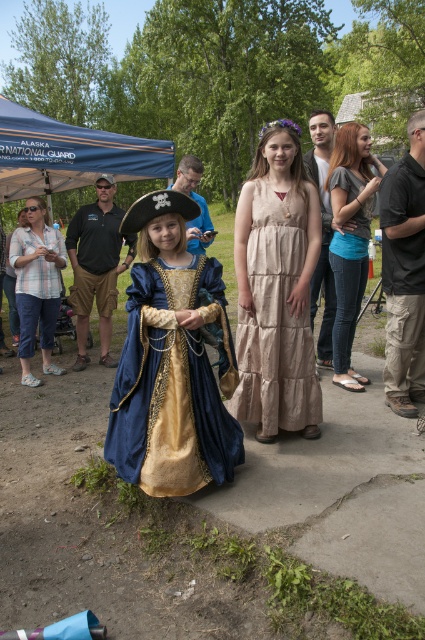
Question: Is matte pirate hat at center to the left of blue jeans at right from the viewer's perspective?

Choices:
 (A) yes
 (B) no

Answer: (A)

Question: Which point is closer to the camera?

Choices:
 (A) velvet gold dress at center
 (B) blue fabric canopy at upper left

Answer: (A)

Question: Is blue fabric canopy at upper left to the right of blue jeans at right from the viewer's perspective?

Choices:
 (A) yes
 (B) no

Answer: (B)

Question: Can you confirm if velvet gold dress at center is bigger than beige cotton dress at center?

Choices:
 (A) no
 (B) yes

Answer: (B)

Question: Which of the following is the closest to the observer?

Choices:
 (A) (198, 176)
 (B) (351, 179)
 (C) (125, 371)
 (D) (56, 148)

Answer: (C)

Question: Considering the real-world distances, which object is farthest from the velvet gold dress at center?

Choices:
 (A) blue fabric canopy at upper left
 (B) plaid shirt at left

Answer: (A)